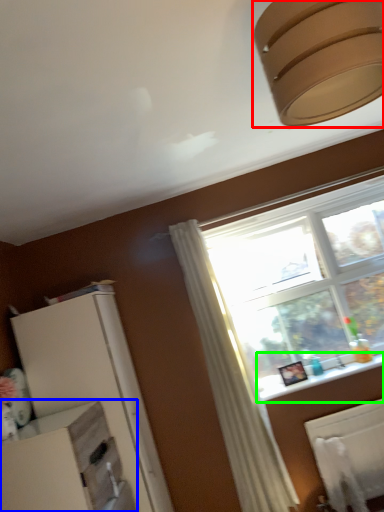
Question: Based on their relative distances, which object is farther from lamp (highlighted by a red box)? Choose from dresser (highlighted by a blue box) and window sill (highlighted by a green box).

Choices:
 (A) dresser
 (B) window sill

Answer: (B)